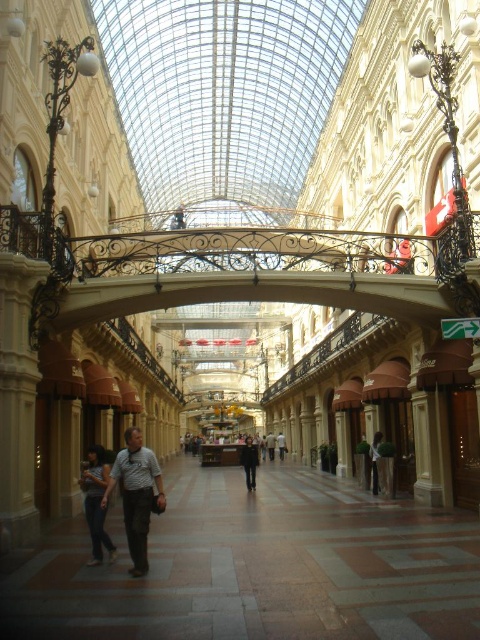
Which is more to the right, denim pants at lower left or white cotton shirt at center?

white cotton shirt at center

Describe the element at coordinates (96, 500) in the screenshot. I see `denim pants at lower left` at that location.

Locate an element on the screen. The image size is (480, 640). denim pants at lower left is located at coordinates (96, 500).

Who is taller, denim pants at lower left or dark gray shirt at center?

With more height is denim pants at lower left.

I want to click on denim pants at lower left, so click(x=96, y=500).

Where is `denim pants at lower left`? denim pants at lower left is located at coordinates (96, 500).

Is point (247, 436) less distant than point (372, 464)?

No, it is not.

Between black fabric jacket at center and white cotton shirt at center, which one has less height?

Standing shorter between the two is white cotton shirt at center.

Between point (250, 440) and point (373, 468), which one is positioned behind?

The point (250, 440) is behind.

In order to click on black fabric jacket at center in this screenshot , I will do `click(250, 461)`.